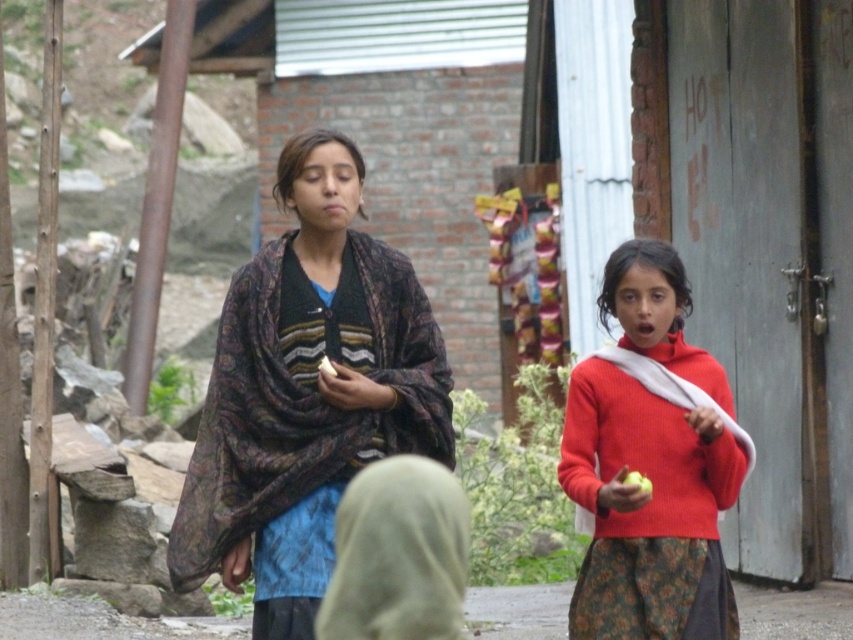
You are a photographer trying to capture both the patterned fabric shawl at center and the matte white shawl at right in a single shot. Based on their positions, which shawl will appear closer to the camera in the photo?

The patterned fabric shawl at center will appear closer to the camera in the photo because it is positioned in front of the matte white shawl at right.